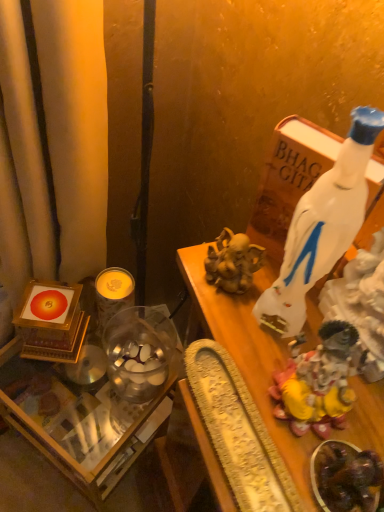
Question: Considering the relative positions of yellow wax candle at center left and translucent glass table at lower left in the image provided, is yellow wax candle at center left to the left or to the right of translucent glass table at lower left?

Choices:
 (A) left
 (B) right

Answer: (B)

Question: Considering the positions of yellow wax candle at center left and translucent glass table at lower left in the image, is yellow wax candle at center left bigger or smaller than translucent glass table at lower left?

Choices:
 (A) small
 (B) big

Answer: (A)

Question: Based on their relative distances, which object is farther from the gold textured tray at center?

Choices:
 (A) yellow wax candle at center left
 (B) shiny dark chocolate at lower right
 (C) white glossy bottle at upper right
 (D) shiny gold statue at right
 (E) translucent glass table at lower left

Answer: (E)

Question: Which object is positioned closest to the yellow wax candle at center left?

Choices:
 (A) gold textured tray at center
 (B) shiny dark chocolate at lower right
 (C) shiny gold statue at right
 (D) white glossy bottle at upper right
 (E) translucent glass table at lower left

Answer: (E)